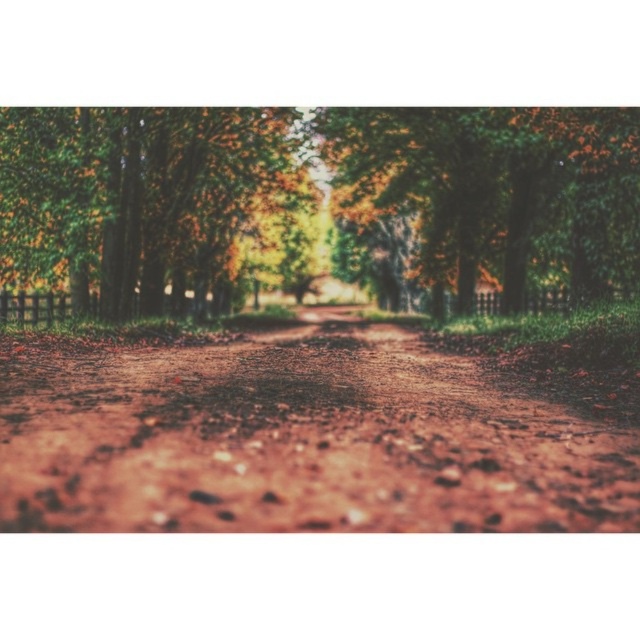
Question: Which of the following is the farthest from the observer?

Choices:
 (A) (449, 515)
 (B) (241, 131)

Answer: (B)

Question: Does green leafy forest at center appear over green leafy tree at center?

Choices:
 (A) no
 (B) yes

Answer: (A)

Question: Can you confirm if green leafy forest at center is positioned to the right of green leafy tree at upper left?

Choices:
 (A) yes
 (B) no

Answer: (A)

Question: Which point is farther to the camera?

Choices:
 (A) (93, 182)
 (B) (48, 376)

Answer: (A)

Question: Can you confirm if brown gravel dirt track at center is wider than green leafy tree at center?

Choices:
 (A) no
 (B) yes

Answer: (A)

Question: Which of the following is the farthest from the observer?

Choices:
 (A) (371, 182)
 (B) (560, 227)
 (C) (140, 195)

Answer: (A)